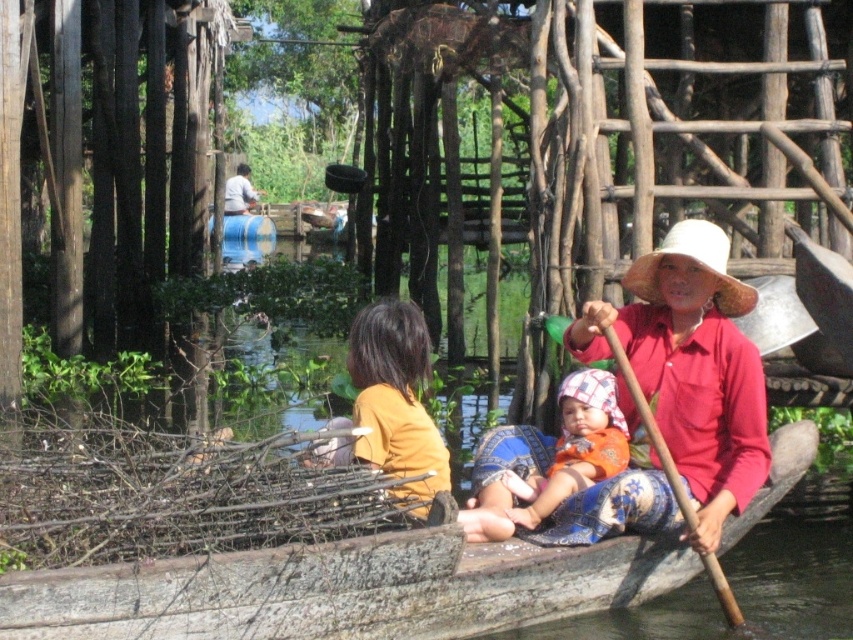
Does orange cotton cloth at center appear on the right side of light blue fabric at upper center?

Correct, you'll find orange cotton cloth at center to the right of light blue fabric at upper center.

The image size is (853, 640). I want to click on orange cotton cloth at center, so click(547, 458).

Image resolution: width=853 pixels, height=640 pixels. What are the coordinates of `orange cotton cloth at center` in the screenshot? It's located at (547, 458).

Is wooden boat at center above light blue fabric at upper center?

No.

Can you confirm if wooden boat at center is smaller than light blue fabric at upper center?

Yes.

Which is behind, point (392, 563) or point (242, 196)?

The point (242, 196) is more distant.

Where is `wooden boat at center`? Image resolution: width=853 pixels, height=640 pixels. wooden boat at center is located at coordinates (344, 589).

Which of these two, brown wood paddle at center or light blue fabric at upper center, stands taller?

Standing taller between the two is light blue fabric at upper center.

Is brown wood paddle at center below light blue fabric at upper center?

Yes.

Between point (697, 520) and point (244, 193), which one is positioned in front?

Point (697, 520) is more forward.

The height and width of the screenshot is (640, 853). I want to click on brown wood paddle at center, so click(x=650, y=426).